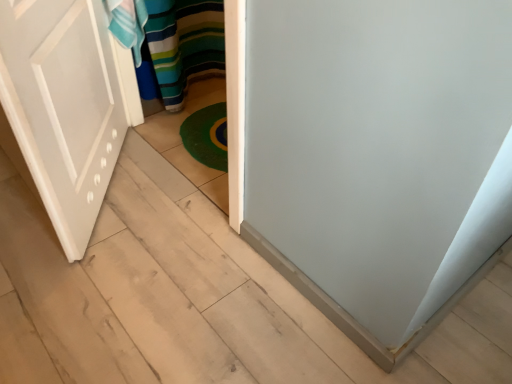
At what (x,y) coordinates should I click in order to perform the action: click on free space in front of white matte door at left. Please return your answer as a coordinate pair (x, y). This screenshot has width=512, height=384. Looking at the image, I should click on (98, 286).